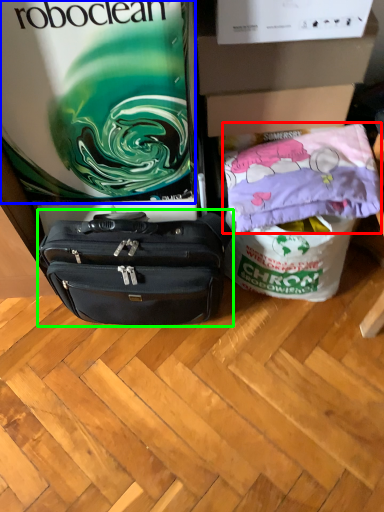
Question: Which object is the closest to the material (highlighted by a red box)? Choose among these: gift bag (highlighted by a blue box) or luggage and bags (highlighted by a green box).

Choices:
 (A) gift bag
 (B) luggage and bags

Answer: (B)